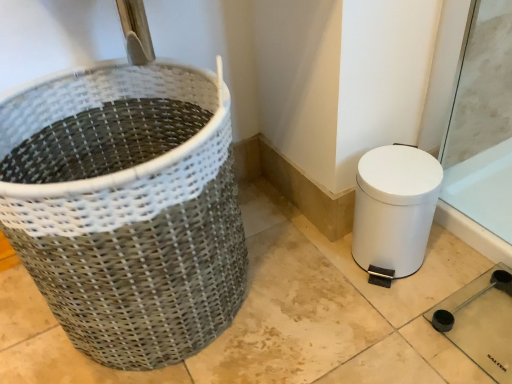
The width and height of the screenshot is (512, 384). Find the location of `vacant space situated above white matte toilet bowl at lower right (from a real-world perspective)`. vacant space situated above white matte toilet bowl at lower right (from a real-world perspective) is located at coordinates 401,172.